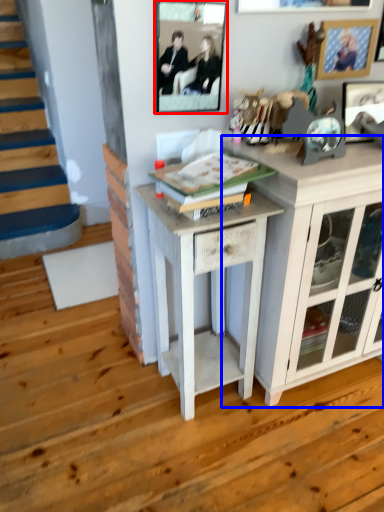
Question: Which point is closer to the camera, picture frame (highlighted by a red box) or cabinetry (highlighted by a blue box)?

Choices:
 (A) picture frame
 (B) cabinetry

Answer: (B)